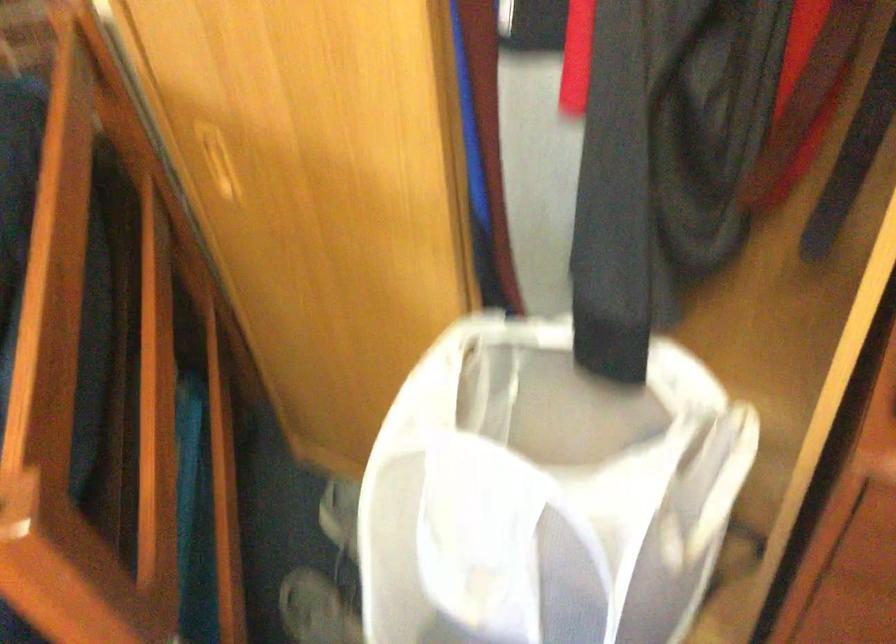
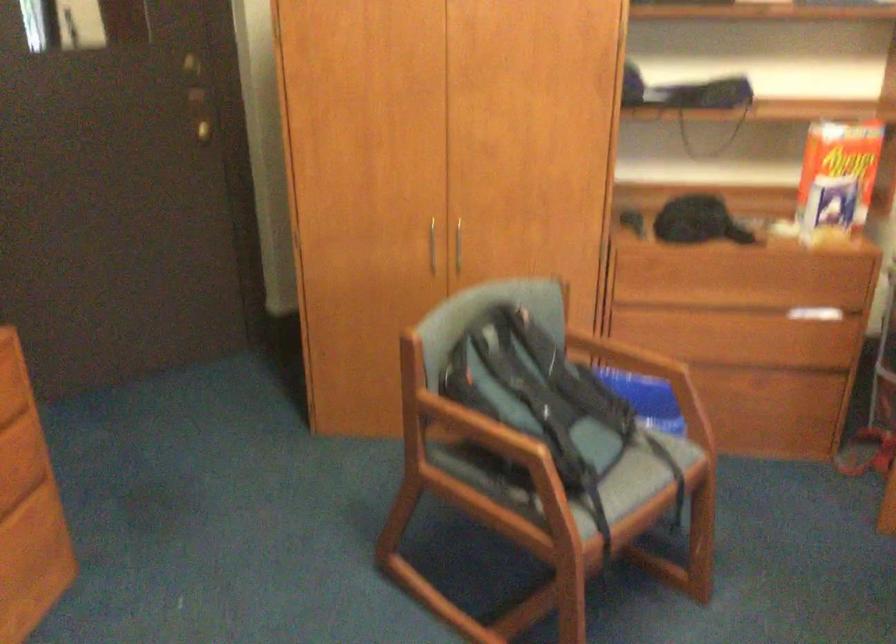
First-person continuous shooting, in which direction is the camera rotating?

The camera's rotation is toward right-down.